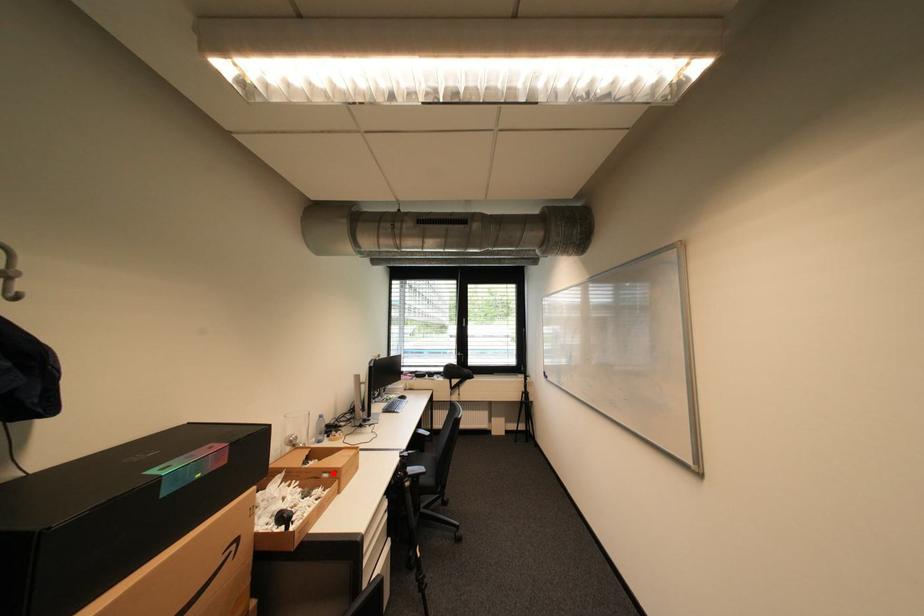
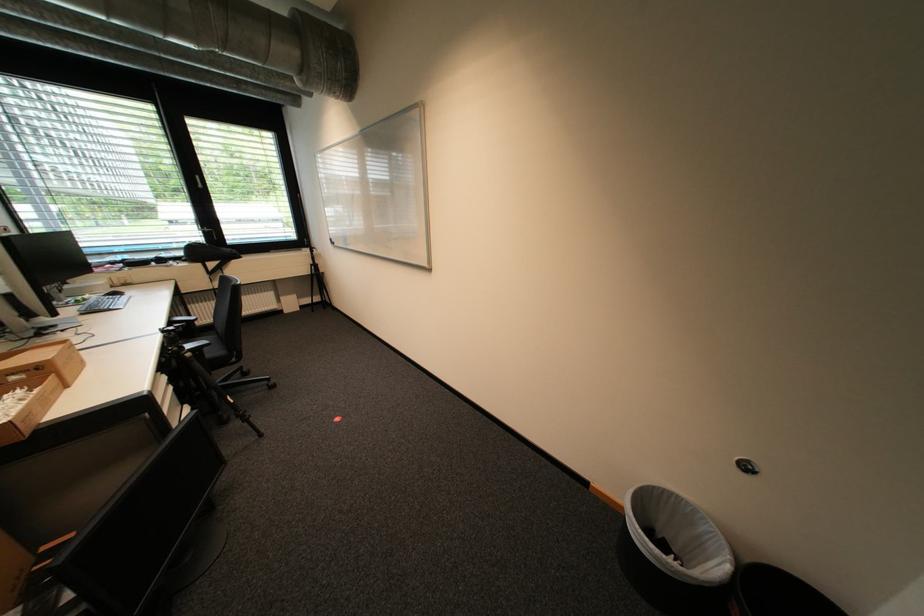
In the second image, find the point that corresponds to the highlighted location in the first image.

(20, 375)